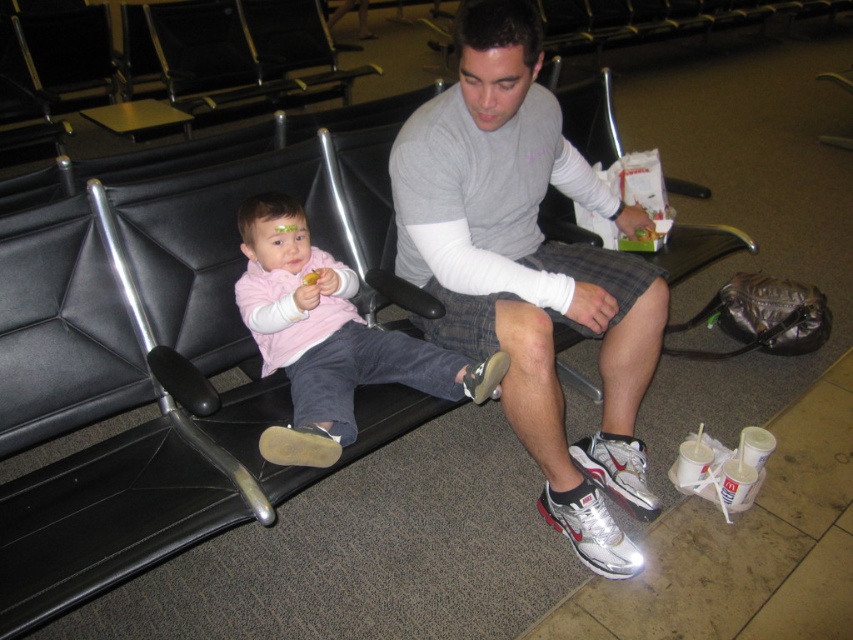
You are a traveler trying to reach your pink fleece sweater at center without disturbing the gray cotton shirt at center. How much space do you have to move between them?

The gray cotton shirt at center and pink fleece sweater at center are 12.69 inches apart from each other, so you have 12.69 inches of space to move between them without disturbing either item.

You are a fashion designer analyzing the clothing items in the waiting area. Which clothing item at center has a greater width between the gray cotton shirt at center and the pink fleece sweater at center?

The gray cotton shirt at center has a greater width than the pink fleece sweater at center according to the description.